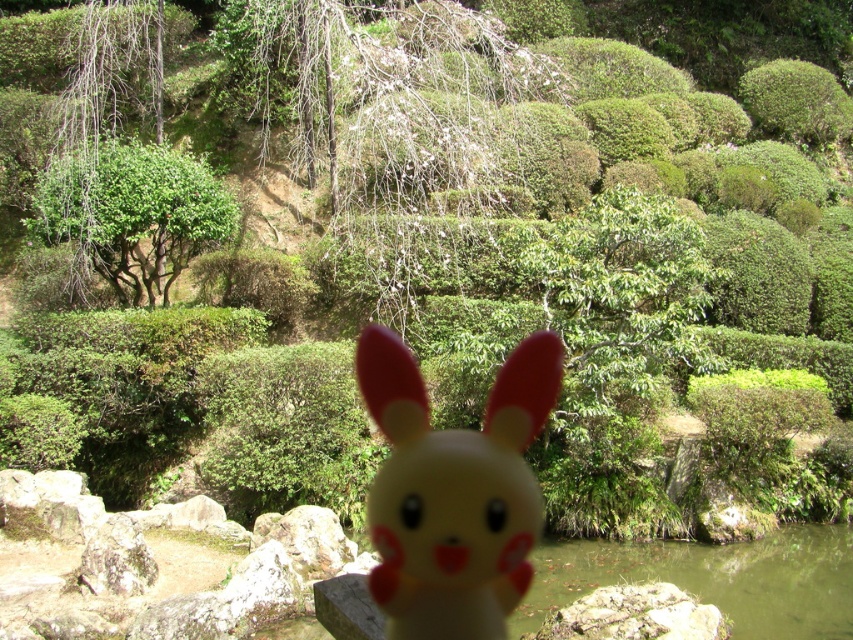
Question: In this image, where is yellow matte plastic bunny at center located relative to green leafy bush at upper left?

Choices:
 (A) right
 (B) left

Answer: (A)

Question: Which point is farther to the camera?

Choices:
 (A) green leafy tree at left
 (B) green leafy bush at upper left

Answer: (A)

Question: Estimate the real-world distances between objects in this image. Which object is farther from the green leafy bush at upper left?

Choices:
 (A) green leafy tree at left
 (B) yellow matte plastic bunny at center

Answer: (B)

Question: Does green leafy bush at upper left come behind green leafy tree at left?

Choices:
 (A) no
 (B) yes

Answer: (A)

Question: Among these objects, which one is farthest from the camera?

Choices:
 (A) green leafy tree at left
 (B) green leafy bush at upper left
 (C) yellow matte plastic bunny at center

Answer: (A)

Question: In this image, where is green leafy bush at upper left located relative to green leafy tree at left?

Choices:
 (A) below
 (B) above

Answer: (A)